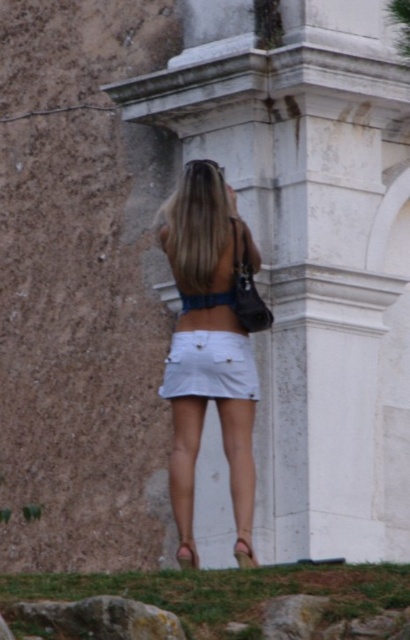
Question: Is white denim skirt at center bigger than white cotton skirt at center?

Choices:
 (A) yes
 (B) no

Answer: (A)

Question: Which object appears farthest from the camera in this image?

Choices:
 (A) gray rough rock at lower left
 (B) white marble pillar at center

Answer: (B)

Question: Does white denim skirt at center appear on the right side of white cotton skirt at center?

Choices:
 (A) yes
 (B) no

Answer: (B)

Question: Which point is closer to the camera?

Choices:
 (A) gray rough rock at lower left
 (B) white denim skirt at center

Answer: (A)

Question: From the image, what is the correct spatial relationship of white cotton skirt at center in relation to gray rough rock at lower left?

Choices:
 (A) above
 (B) below

Answer: (A)

Question: Which of the following is the farthest from the observer?

Choices:
 (A) (234, 314)
 (B) (93, 620)
 (C) (196, 346)

Answer: (A)